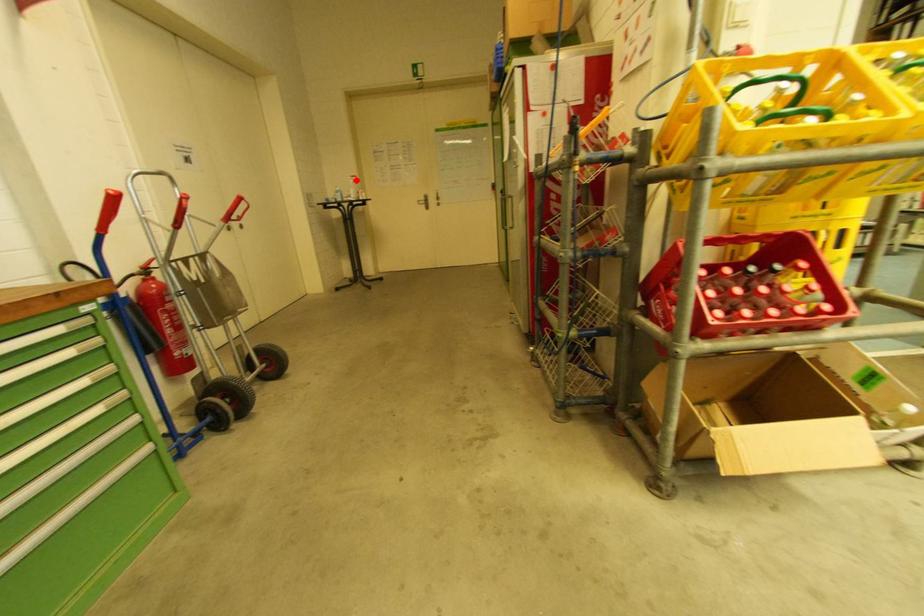
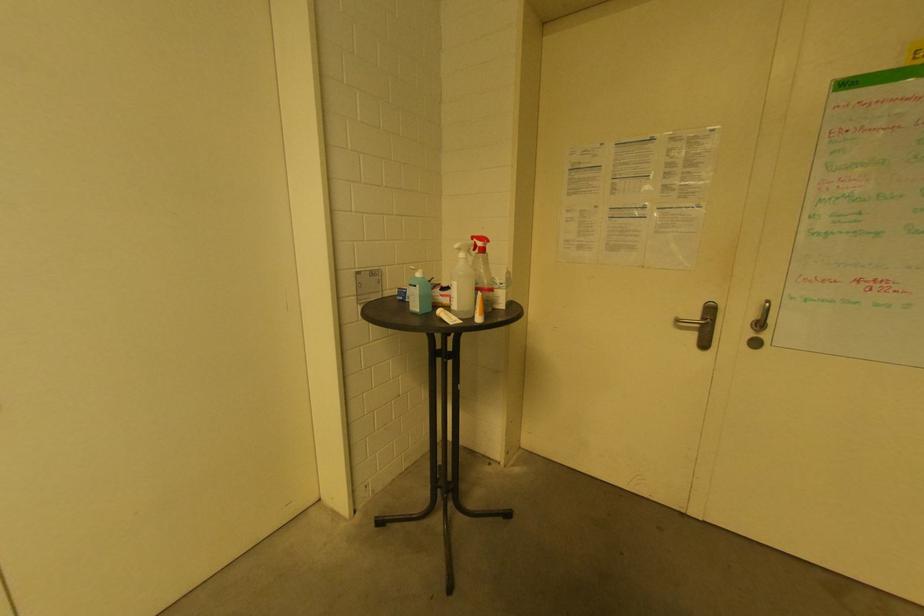
Question: A red point is marked in image1. In image2, is the corresponding 3D point closer to the camera or farther? Reply with the corresponding letter.

Choices:
 (A) The corresponding 3D point is closer.
 (B) The corresponding 3D point is farther.

Answer: (B)